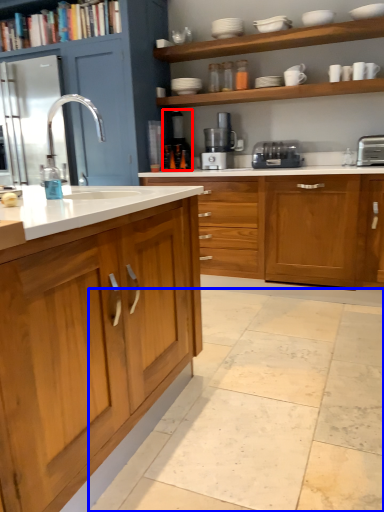
Question: Which of the following is the closest to the observer, coffee machine (highlighted by a red box) or ceramic tile (highlighted by a blue box)?

Choices:
 (A) coffee machine
 (B) ceramic tile

Answer: (B)